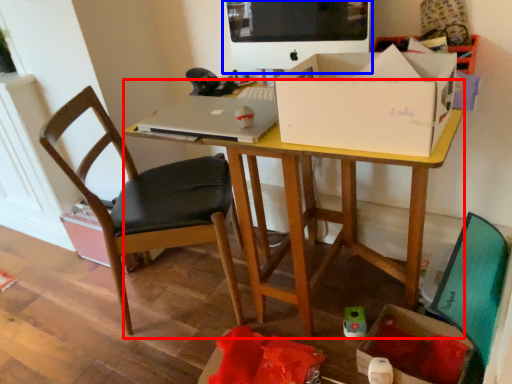
Question: Among these objects, which one is nearest to the camera, desk (highlighted by a red box) or computer monitor (highlighted by a blue box)?

Choices:
 (A) desk
 (B) computer monitor

Answer: (A)